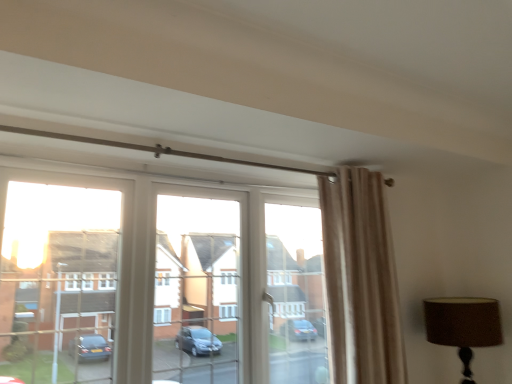
Question: Considering the relative positions of beige velvet curtain at upper right and transparent glass window at center in the image provided, is beige velvet curtain at upper right behind transparent glass window at center?

Choices:
 (A) yes
 (B) no

Answer: (A)

Question: Does beige velvet curtain at upper right have a greater height compared to transparent glass window at center?

Choices:
 (A) yes
 (B) no

Answer: (A)

Question: Is beige velvet curtain at upper right to the right of transparent glass window at center from the viewer's perspective?

Choices:
 (A) yes
 (B) no

Answer: (A)

Question: Does beige velvet curtain at upper right appear on the left side of transparent glass window at center?

Choices:
 (A) no
 (B) yes

Answer: (A)

Question: Considering the relative sizes of beige velvet curtain at upper right and transparent glass window at center in the image provided, is beige velvet curtain at upper right bigger than transparent glass window at center?

Choices:
 (A) no
 (B) yes

Answer: (A)

Question: Does beige velvet curtain at upper right have a lesser width compared to transparent glass window at center?

Choices:
 (A) yes
 (B) no

Answer: (B)

Question: Would you say beige velvet curtain at upper right is a long distance from brown fabric lampshade at upper right?

Choices:
 (A) no
 (B) yes

Answer: (A)

Question: From a real-world perspective, is beige velvet curtain at upper right located higher than brown fabric lampshade at upper right?

Choices:
 (A) yes
 (B) no

Answer: (A)

Question: Is beige velvet curtain at upper right shorter than brown fabric lampshade at upper right?

Choices:
 (A) no
 (B) yes

Answer: (A)

Question: Is beige velvet curtain at upper right at the left side of brown fabric lampshade at upper right?

Choices:
 (A) no
 (B) yes

Answer: (B)

Question: Is beige velvet curtain at upper right bigger than brown fabric lampshade at upper right?

Choices:
 (A) no
 (B) yes

Answer: (B)

Question: Can you confirm if beige velvet curtain at upper right is smaller than brown fabric lampshade at upper right?

Choices:
 (A) no
 (B) yes

Answer: (A)

Question: Does transparent glass window at center have a greater height compared to beige velvet curtain at upper right?

Choices:
 (A) yes
 (B) no

Answer: (B)